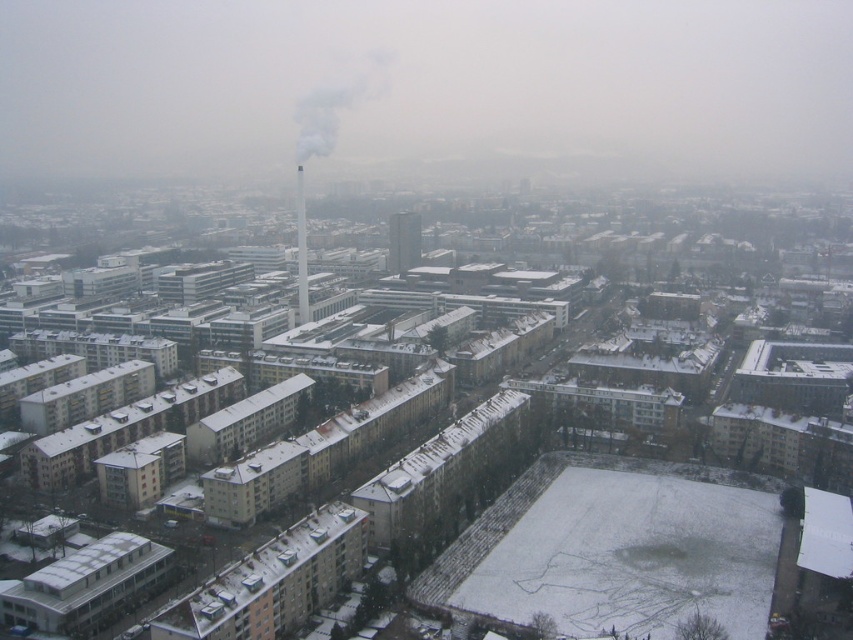
You are a drone operator flying a drone over the city. You notice the white smoke at center and the smooth concrete tower at center in the image. Which object is closer to the drone?

The white smoke at center is closer to the drone because the smooth concrete tower at center is behind it.